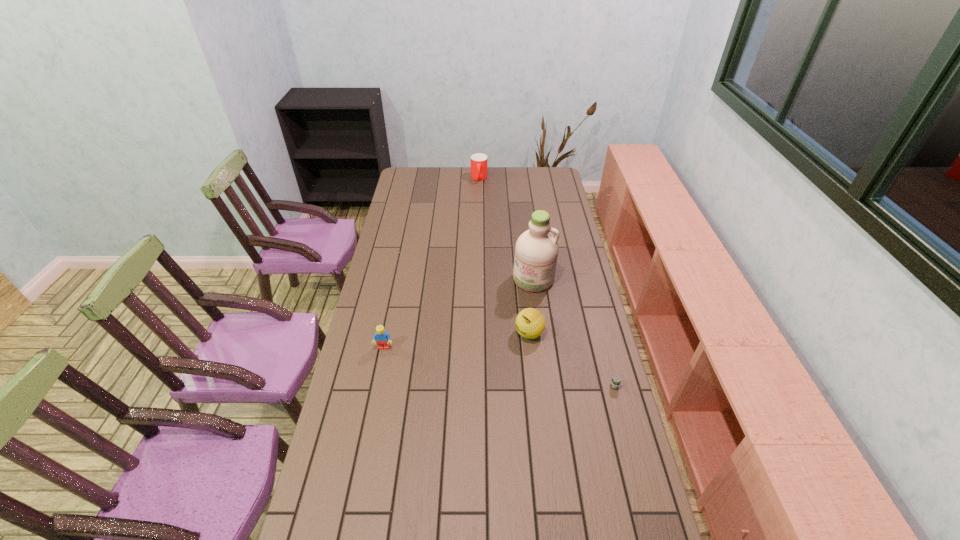
Find the location of a particular element. The image size is (960, 540). Lego is located at coordinates (382, 338).

Where is `the rightmost object`? This screenshot has height=540, width=960. the rightmost object is located at coordinates (616, 380).

This screenshot has width=960, height=540. I want to click on the nearest object, so click(x=616, y=380).

Find the location of a particular element. The width and height of the screenshot is (960, 540). the fourth nearest object is located at coordinates (536, 251).

This screenshot has width=960, height=540. Find the location of `the tallest object`. the tallest object is located at coordinates (536, 251).

I want to click on the second object from left to right, so click(x=479, y=161).

Where is `cup`? The height and width of the screenshot is (540, 960). cup is located at coordinates (479, 161).

The width and height of the screenshot is (960, 540). Find the location of `softball`. softball is located at coordinates (530, 323).

In order to click on free space located on the face of the leftmost object in this screenshot , I will do `click(379, 372)`.

The height and width of the screenshot is (540, 960). In order to click on vacant space located on the left of the nearest object in this screenshot , I will do `click(579, 387)`.